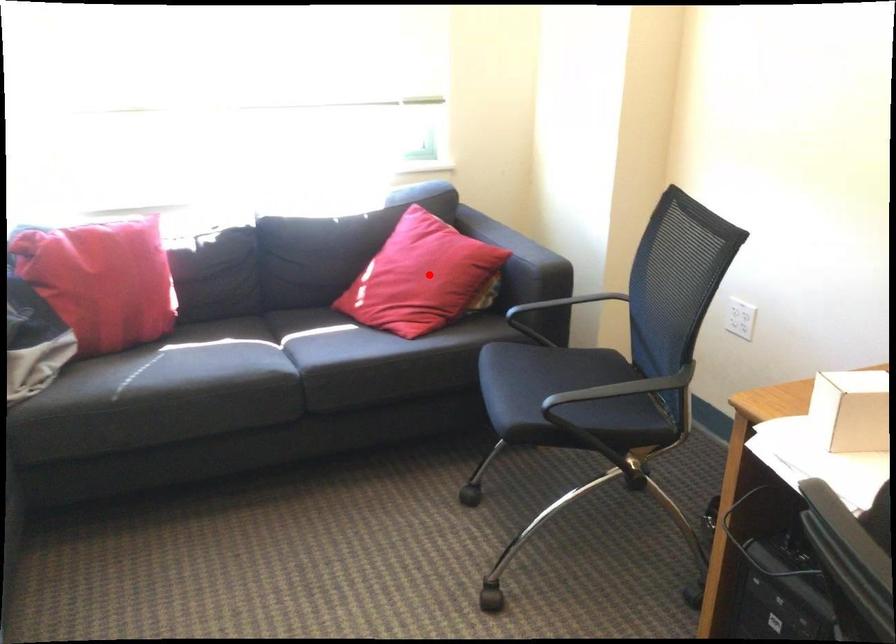
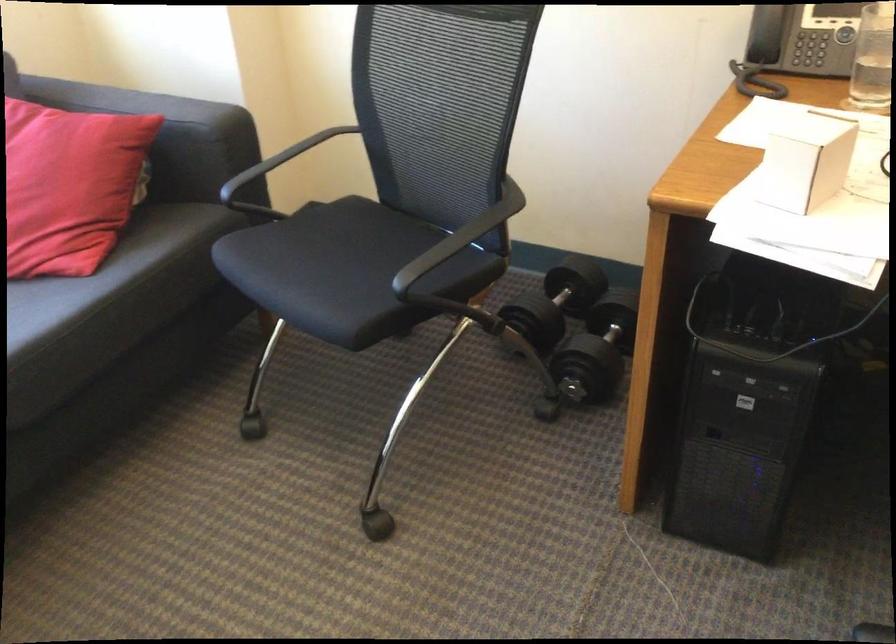
Where in the second image is the point corresponding to the highlighted location from the first image?

(69, 185)